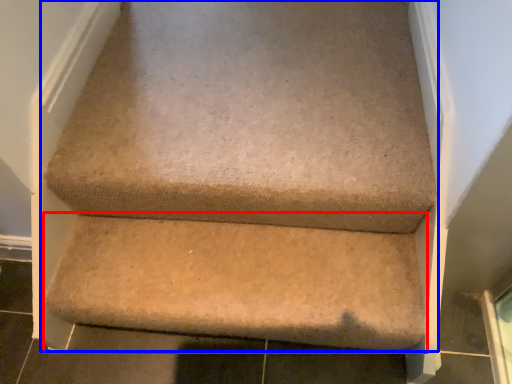
Question: Which of the following is the farthest to the observer, stairwell (highlighted by a red box) or furniture (highlighted by a blue box)?

Choices:
 (A) stairwell
 (B) furniture

Answer: (A)